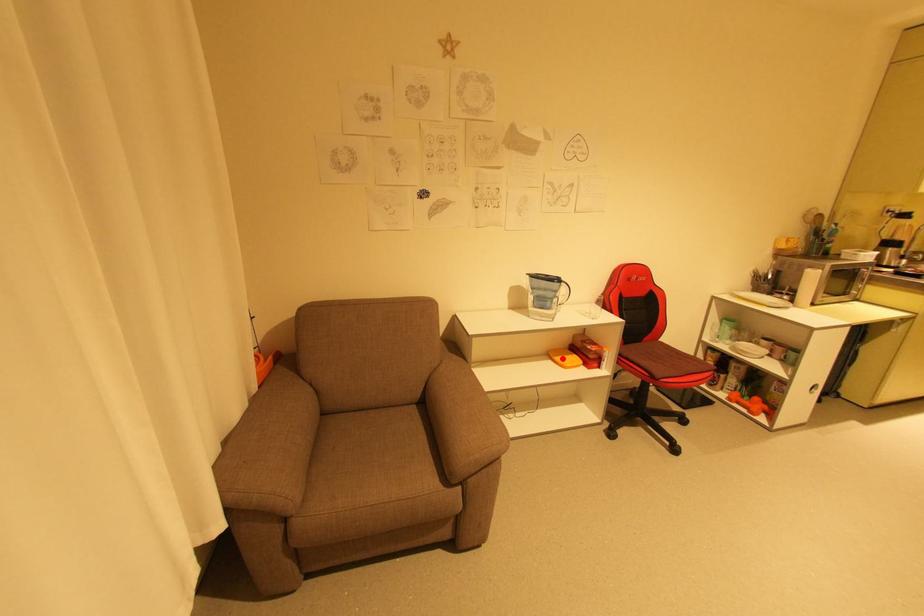
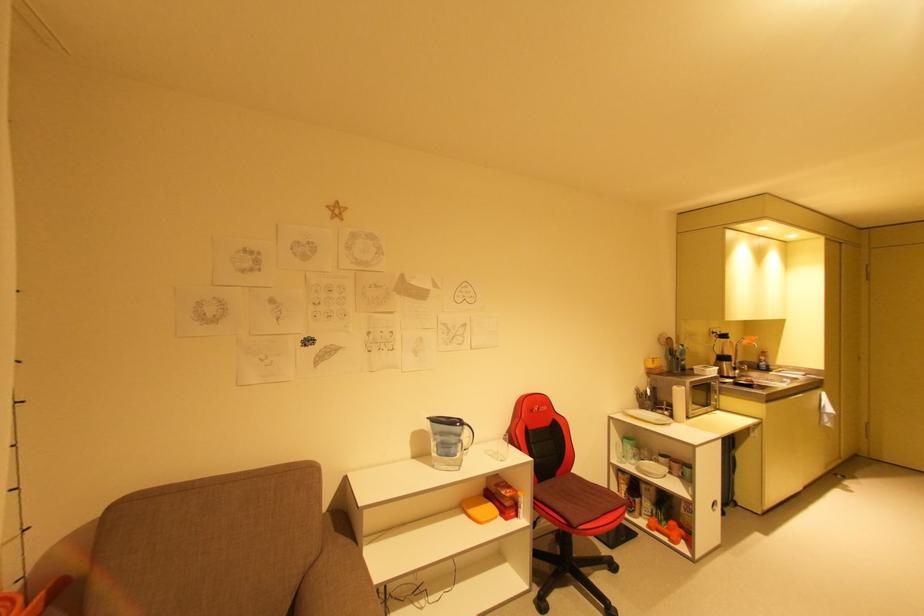
Question: A red point is marked in image1. In image2, is the corresponding 3D point closer to the camera or farther? Reply with the corresponding letter.

Choices:
 (A) The corresponding 3D point is closer.
 (B) The corresponding 3D point is farther.

Answer: (B)